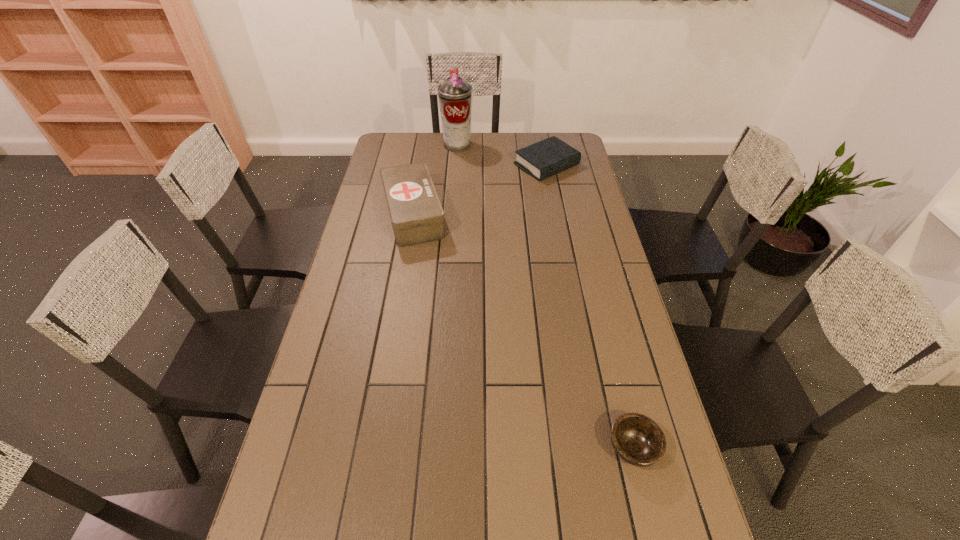
Identify the location of Bible located at the far edge. (543, 159).

Where is `object that is at the left edge`? object that is at the left edge is located at coordinates (416, 214).

Where is `Bible present at the right edge`? The width and height of the screenshot is (960, 540). Bible present at the right edge is located at coordinates (x=543, y=159).

At what (x,y) coordinates should I click in order to perform the action: click on bowl that is at the right edge. Please return your answer as a coordinate pair (x, y). This screenshot has width=960, height=540. Looking at the image, I should click on (638, 440).

Where is `object located at the far right corner`? Image resolution: width=960 pixels, height=540 pixels. object located at the far right corner is located at coordinates (543, 159).

This screenshot has height=540, width=960. What are the coordinates of `free space at the far edge of the desktop` in the screenshot? It's located at (478, 151).

Find the location of a particular element. The image size is (960, 540). vacant space at the left edge of the desktop is located at coordinates (294, 507).

The height and width of the screenshot is (540, 960). What are the coordinates of `blank space at the right edge` in the screenshot? It's located at (569, 229).

Image resolution: width=960 pixels, height=540 pixels. I want to click on free location at the far left corner, so click(x=414, y=134).

This screenshot has width=960, height=540. Find the location of `empty space that is in between the Bible and the bowl`. empty space that is in between the Bible and the bowl is located at coordinates (589, 306).